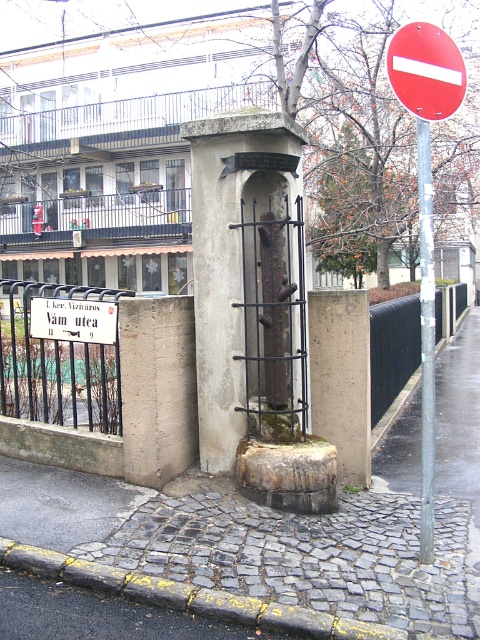
Question: Can you confirm if yellow painted concrete curb at lower center is positioned to the left of silver metallic pole at right?

Choices:
 (A) yes
 (B) no

Answer: (A)

Question: Which point is closer to the camera?

Choices:
 (A) red metallic circle at upper right
 (B) red matte circle at upper right
 (C) white paper sign at upper center
 (D) concrete textured pillar at center

Answer: (A)

Question: Does cobblestone pavement at center come behind white paper sign at upper center?

Choices:
 (A) no
 (B) yes

Answer: (A)

Question: Does cobblestone pavement at center appear over red matte circle at upper right?

Choices:
 (A) no
 (B) yes

Answer: (A)

Question: Which object is closer to the camera taking this photo?

Choices:
 (A) white paper sign at upper center
 (B) silver metallic pole at right

Answer: (B)

Question: Which point is farther to the camera?

Choices:
 (A) coord(188,621)
 (B) coord(429,230)
 (C) coord(421,38)
 (D) coord(220,344)

Answer: (D)